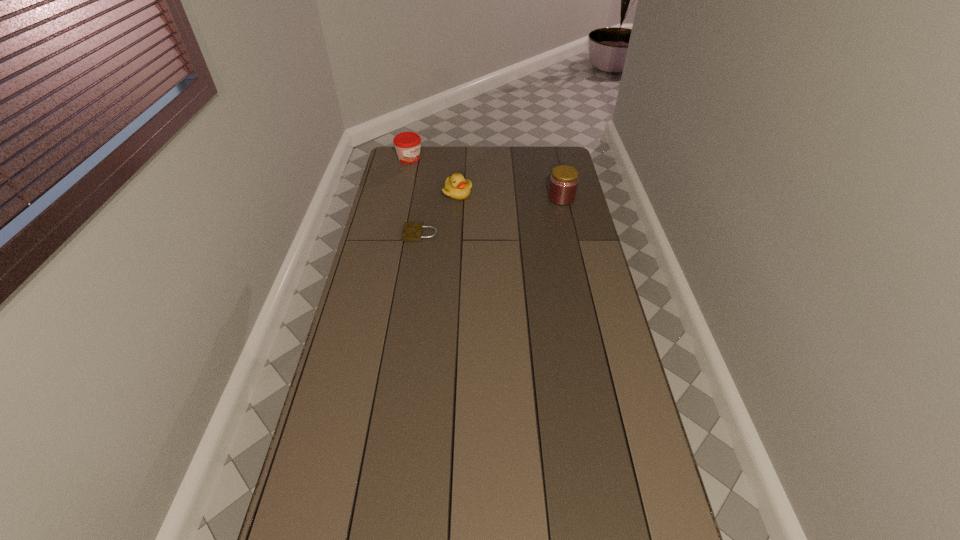
Locate an element on the screen. This screenshot has height=540, width=960. vacant spot on the desktop that is between the shortest object and the tallest object and is positioned on the front-facing side of the duckling is located at coordinates (507, 212).

At what (x,y) coordinates should I click in order to perform the action: click on free spot on the desktop that is between the nearest object and the nearer jam and is positioned on the label side of the farthest object. Please return your answer as a coordinate pair (x, y). This screenshot has height=540, width=960. Looking at the image, I should click on (508, 212).